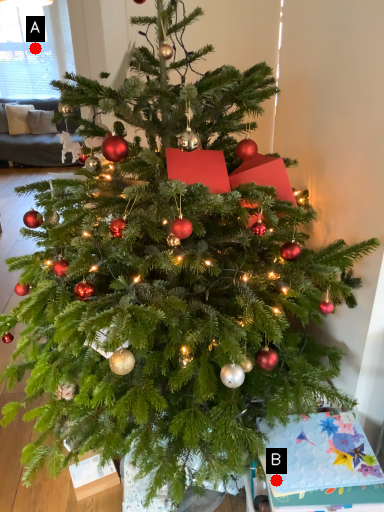
Question: Two points are circled on the image, labeled by A and B beside each circle. Among these points, which one is farthest from the camera?

Choices:
 (A) A is further
 (B) B is further

Answer: (A)